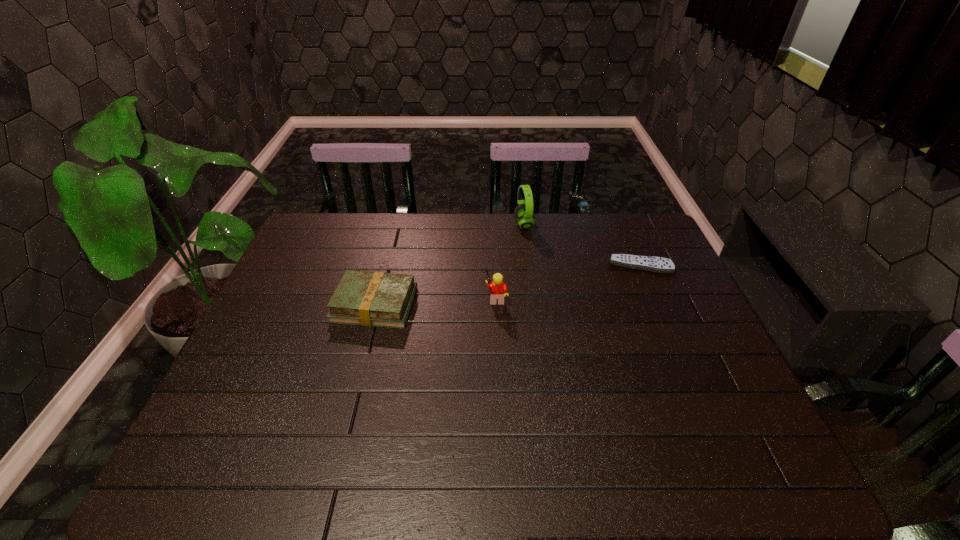
Identify the location of vacant space situated 0.370m in front of the Lego with the accessory visible. (357, 298).

The height and width of the screenshot is (540, 960). I want to click on vacant space located in front of the Lego with the accessory visible, so click(378, 298).

Locate an element on the screen. This screenshot has width=960, height=540. vacant space situated on the right of the third tallest object is located at coordinates (531, 305).

Where is `free location located on the back of the remote control`? The width and height of the screenshot is (960, 540). free location located on the back of the remote control is located at coordinates 626,233.

Find the location of a particular element. The width and height of the screenshot is (960, 540). object that is at the far edge is located at coordinates (523, 213).

Locate an element on the screen. This screenshot has width=960, height=540. object that is at the right edge is located at coordinates (648, 263).

Image resolution: width=960 pixels, height=540 pixels. I want to click on free space at the far edge of the desktop, so click(x=520, y=231).

Identify the location of free space at the near edge. (564, 463).

Find the location of a particular element. vacant area at the left edge of the desktop is located at coordinates [x=303, y=275].

In order to click on free space at the right edge of the desktop in this screenshot , I will do `click(687, 338)`.